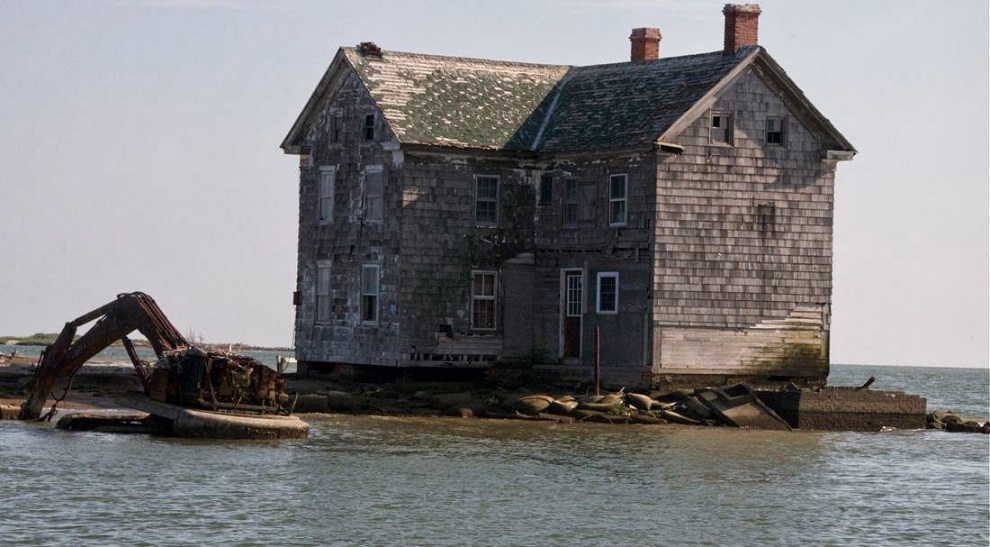
Locate an element on the screen. The height and width of the screenshot is (547, 990). chimneys is located at coordinates (742, 17), (651, 43).